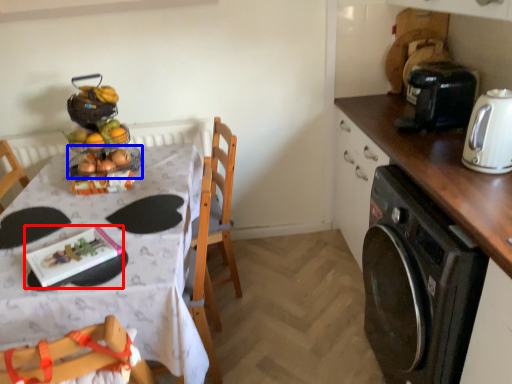
Question: Which point is closer to the camera, tableware (highlighted by a red box) or basket (highlighted by a blue box)?

Choices:
 (A) tableware
 (B) basket

Answer: (A)